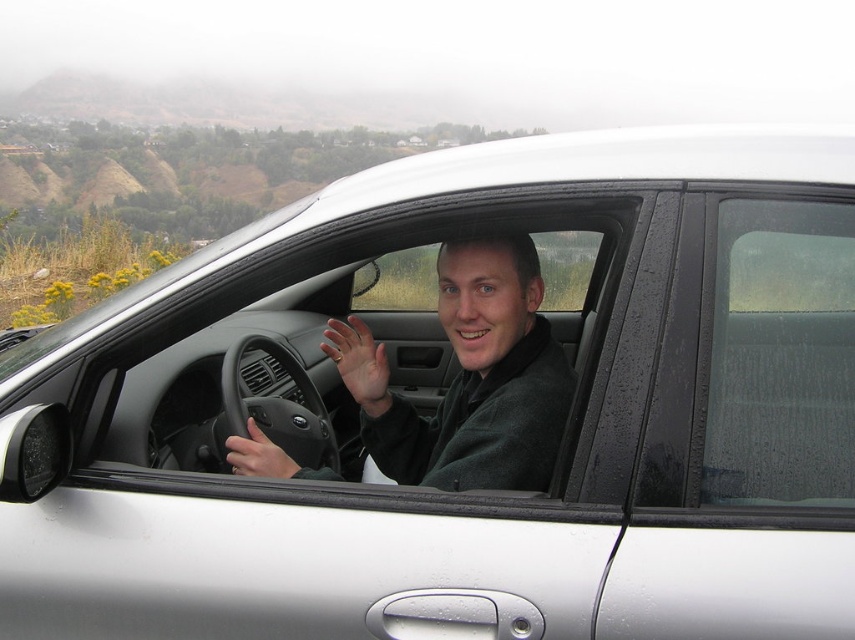
Can you confirm if wet glass window at center right is thinner than matte skin hand at center?

No, wet glass window at center right is not thinner than matte skin hand at center.

Which is more to the right, wet glass window at center right or matte skin hand at center?

wet glass window at center right is more to the right.

Does point (842, 476) come behind point (380, 406)?

No, (842, 476) is closer to viewer.

The image size is (855, 640). I want to click on wet glass window at center right, so click(x=781, y=356).

Which of these two, matte skin hand at center or matte black steering wheel at center, stands shorter?

matte black steering wheel at center is shorter.

Between matte skin hand at center and matte black steering wheel at center, which one appears on the left side from the viewer's perspective?

matte black steering wheel at center

The image size is (855, 640). In order to click on matte skin hand at center in this screenshot , I will do `click(358, 362)`.

Locate an element on the screen. matte skin hand at center is located at coordinates (358, 362).

Is dark gray fleece jacket at center behind matte black steering wheel at center?

No, it is in front of matte black steering wheel at center.

Locate an element on the screen. The width and height of the screenshot is (855, 640). dark gray fleece jacket at center is located at coordinates (469, 378).

Where is `dark gray fleece jacket at center`? The image size is (855, 640). dark gray fleece jacket at center is located at coordinates (469, 378).